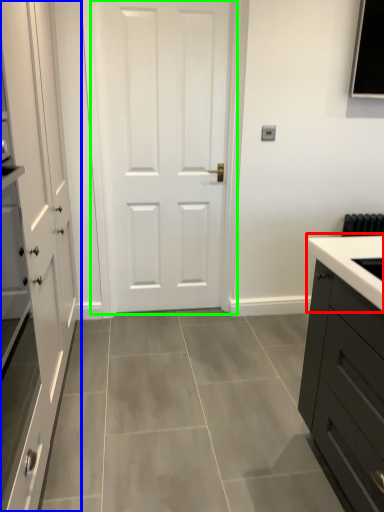
Question: Which object is positioned closest to sink (highlighted by a red box)? Select from cabinetry (highlighted by a blue box) and door (highlighted by a green box).

Choices:
 (A) cabinetry
 (B) door

Answer: (A)